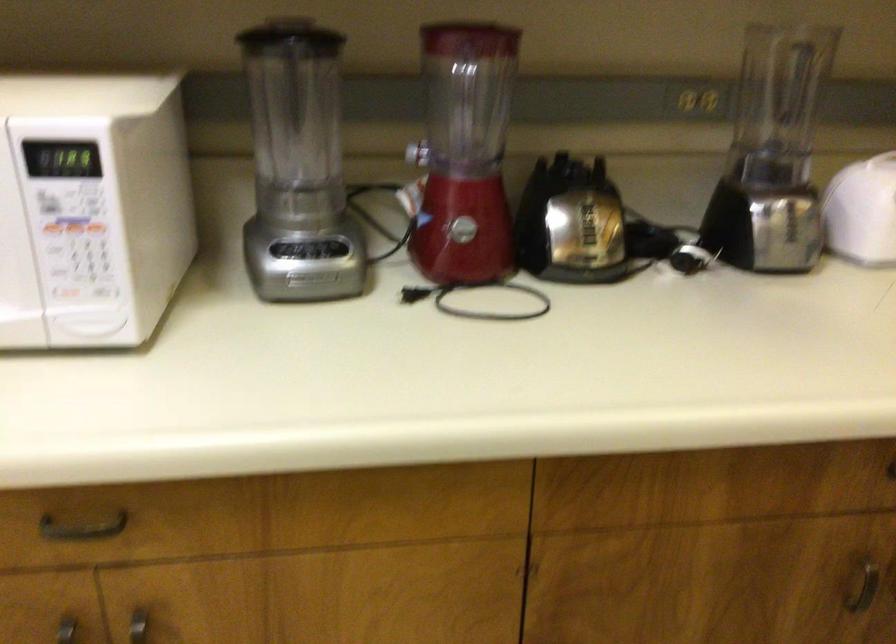
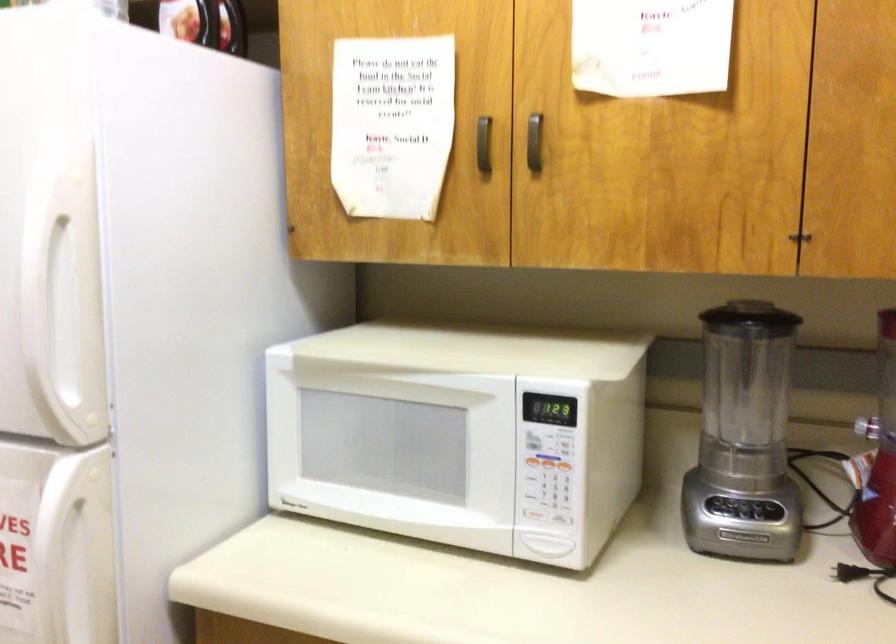
Where in the second image is the point corresponding to point 306,252 from the first image?

(744, 512)